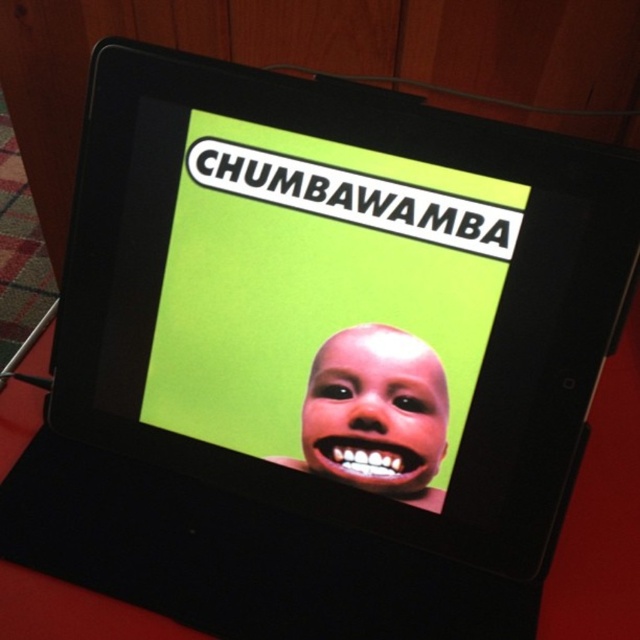
Between green matte poster at center and smooth skin face at center, which one is positioned lower?

Positioned lower is smooth skin face at center.

Is green matte poster at center behind smooth skin face at center?

No, it is in front of smooth skin face at center.

The image size is (640, 640). What are the coordinates of `green matte poster at center` in the screenshot? It's located at (324, 301).